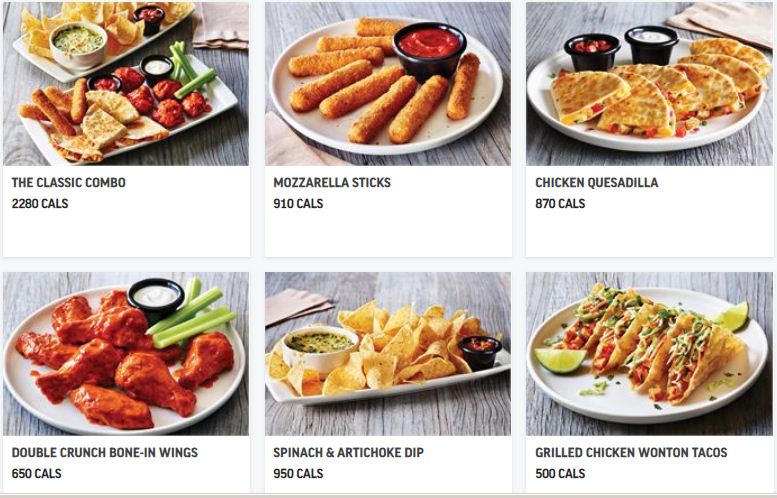
At what (x,y) coordinates should I click in order to perform the action: click on table. Please return your answer as a coordinate pair (x, y). Image resolution: width=777 pixels, height=498 pixels. Looking at the image, I should click on (297, 16), (19, 74), (568, 27), (385, 288), (549, 293), (44, 284).